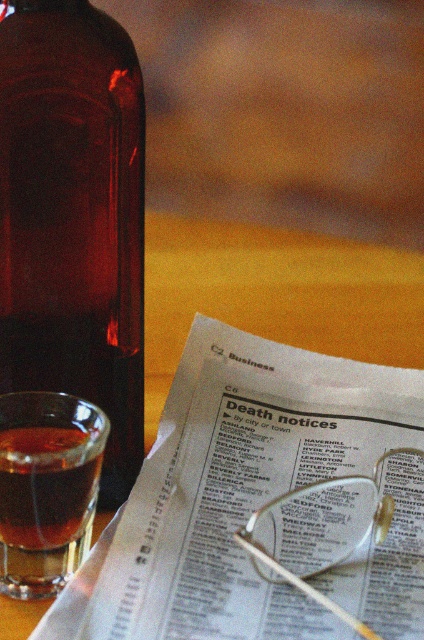
You are a delivery person who needs to place a package on the surface where the white glossy newspaper at center is located. Is there enough space around the newspaper to place the package without moving any items?

The white glossy newspaper at center is located at point (257,499), but without knowing the size of the package or the dimensions of the surface, it is impossible to determine if there is enough space. Please provide more details about the package size or the surface area available.

You are organizing items on a table. You have a white glossy newspaper at center and a brown glass bottle at left. According to the scene, where should you place the brown glass bottle relative to the newspaper?

The brown glass bottle at left should be placed to the left of the white glossy newspaper at center, as it is positioned to the left of the newspaper in the scene.

You are a photographer adjusting your camera settings to capture the white glossy newspaper at center and the translucent amber glass at left. Since the newspaper is closer to the viewer, which object will appear larger in the photo?

The white glossy newspaper at center will appear larger in the photo because it is closer to the viewer than the translucent amber glass at left.